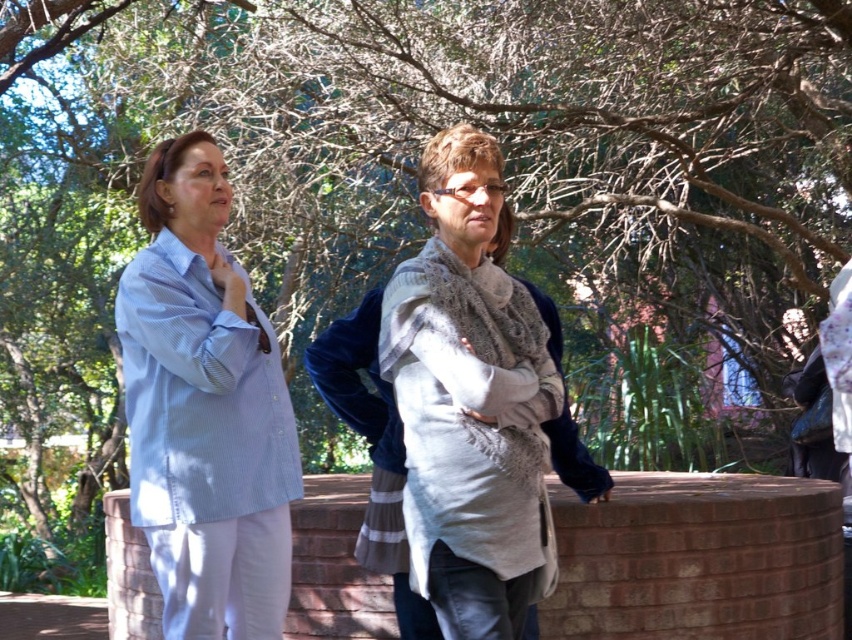
Question: Does light blue striped shirt at left appear on the right side of knitted gray scarf at center?

Choices:
 (A) yes
 (B) no

Answer: (B)

Question: Which point appears closest to the camera in this image?

Choices:
 (A) (154, 500)
 (B) (496, 300)

Answer: (B)

Question: Where is light blue striped shirt at left located in relation to knitted gray scarf at center in the image?

Choices:
 (A) above
 (B) below

Answer: (B)

Question: Which of the following is the farthest from the observer?

Choices:
 (A) knitted gray scarf at center
 (B) light blue striped shirt at left

Answer: (B)

Question: Is light blue striped shirt at left to the right of knitted gray scarf at center from the viewer's perspective?

Choices:
 (A) no
 (B) yes

Answer: (A)

Question: Which point appears farthest from the camera in this image?

Choices:
 (A) (202, 400)
 (B) (505, 496)

Answer: (A)